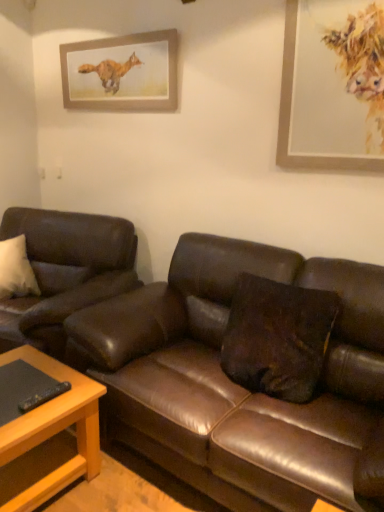
Question: Considering the relative sizes of light brown wooden table at lower left and wooden picture frame at upper center, which is the 1th picture frame in left-to-right order, in the image provided, is light brown wooden table at lower left smaller than wooden picture frame at upper center, which is the 1th picture frame in left-to-right order,?

Choices:
 (A) yes
 (B) no

Answer: (B)

Question: Is light brown wooden table at lower left turned away from wooden picture frame at upper center, which is the 1th picture frame in left-to-right order?

Choices:
 (A) yes
 (B) no

Answer: (B)

Question: Is light brown wooden table at lower left positioned beyond the bounds of wooden picture frame at upper center, which is the 2th picture frame in right-to-left order?

Choices:
 (A) no
 (B) yes

Answer: (B)

Question: From a real-world perspective, is light brown wooden table at lower left physically above wooden picture frame at upper center, which is the 1th picture frame in left-to-right order?

Choices:
 (A) no
 (B) yes

Answer: (A)

Question: Considering the relative sizes of light brown wooden table at lower left and wooden picture frame at upper center, which is the 2th picture frame in right-to-left order, in the image provided, is light brown wooden table at lower left shorter than wooden picture frame at upper center, which is the 2th picture frame in right-to-left order,?

Choices:
 (A) no
 (B) yes

Answer: (A)

Question: Is point [329, 370] positioned closer to the camera than point [34, 390]?

Choices:
 (A) closer
 (B) farther

Answer: (B)

Question: From the image's perspective, is brown leather couch at center, which appears as the first studio couch when viewed from the right, positioned above or below light brown wooden table at lower left?

Choices:
 (A) below
 (B) above

Answer: (B)

Question: Based on their positions, is brown leather couch at center, arranged as the 2th studio couch when viewed from the left, located to the left or right of light brown wooden table at lower left?

Choices:
 (A) right
 (B) left

Answer: (A)

Question: Based on their sizes in the image, would you say brown leather couch at center, arranged as the 2th studio couch when viewed from the left, is bigger or smaller than light brown wooden table at lower left?

Choices:
 (A) big
 (B) small

Answer: (A)

Question: In terms of height, does light brown wooden table at lower left look taller or shorter compared to leather couch at left, arranged as the first studio couch when viewed from the left?

Choices:
 (A) short
 (B) tall

Answer: (A)

Question: From the image's perspective, is light brown wooden table at lower left positioned above or below leather couch at left, arranged as the first studio couch when viewed from the left?

Choices:
 (A) above
 (B) below

Answer: (B)

Question: In terms of width, does light brown wooden table at lower left look wider or thinner when compared to leather couch at left, the 2th studio couch from the right?

Choices:
 (A) thin
 (B) wide

Answer: (A)

Question: Considering the positions of light brown wooden table at lower left and leather couch at left, the 2th studio couch from the right, in the image, is light brown wooden table at lower left bigger or smaller than leather couch at left, the 2th studio couch from the right,?

Choices:
 (A) big
 (B) small

Answer: (B)

Question: Is brown leather couch at center, which appears as the first studio couch when viewed from the right, taller or shorter than wooden picture frame at upper right, marked as the 1th picture frame in a front-to-back arrangement?

Choices:
 (A) tall
 (B) short

Answer: (A)

Question: Considering the positions of brown leather couch at center, which appears as the first studio couch when viewed from the right, and wooden picture frame at upper right, which ranks as the 2th picture frame in back-to-front order, in the image, is brown leather couch at center, which appears as the first studio couch when viewed from the right, wider or thinner than wooden picture frame at upper right, which ranks as the 2th picture frame in back-to-front order,?

Choices:
 (A) wide
 (B) thin

Answer: (A)